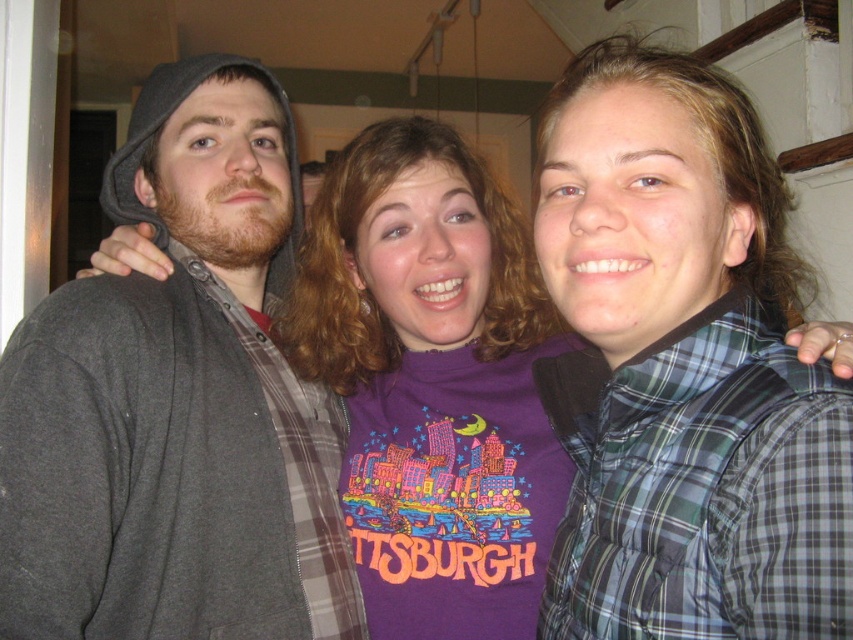
You are standing in front of a group photo of three people. You need to determine the spatial relationship between the green plaid vest at right and the dark gray hoodie at left. Which one is positioned higher in the image?

The green plaid vest at right is positioned higher than the dark gray hoodie at left in the image.